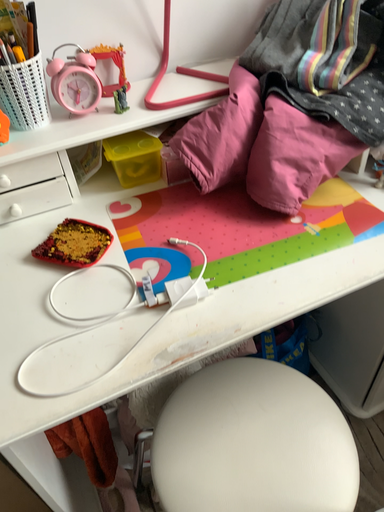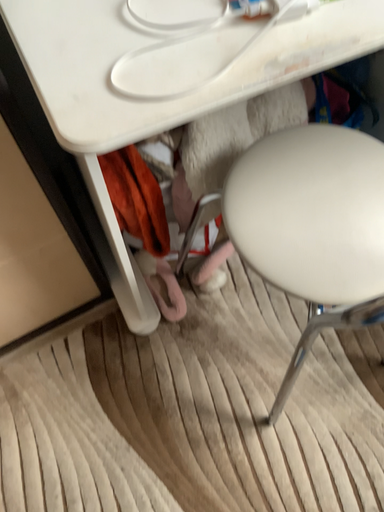
Question: Which way did the camera rotate in the video?

Choices:
 (A) rotated upward
 (B) rotated downward

Answer: (B)